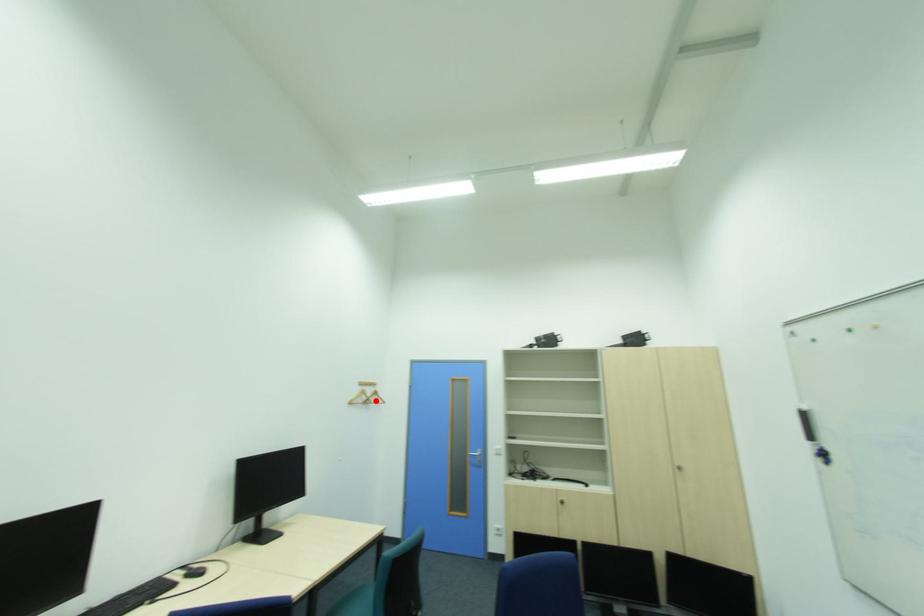
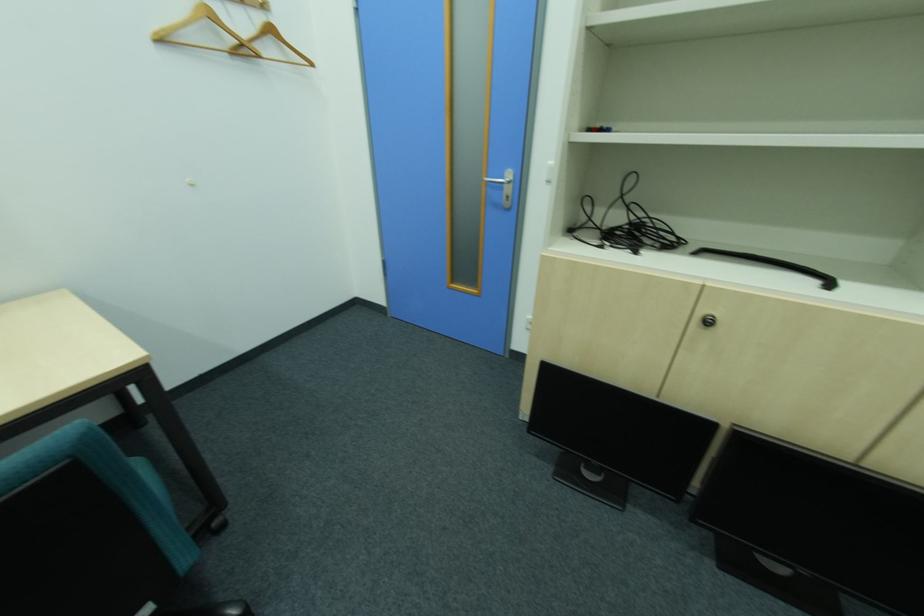
Where in the second image is the point corresponding to the highlighted location from the first image?

(249, 45)